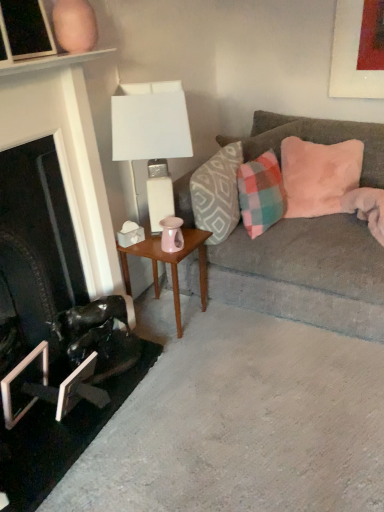
The image size is (384, 512). Identify the location of vacant space behind metallic silver picture frame at lower left, which ranks as the 3th picture frame in top-to-bottom order. (100, 382).